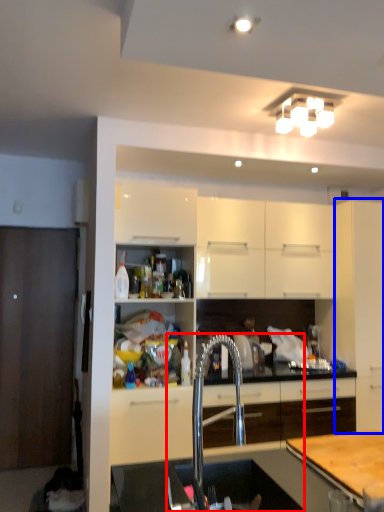
Question: Which object is closer to the camera taking this photo, sink (highlighted by a red box) or cabinetry (highlighted by a blue box)?

Choices:
 (A) sink
 (B) cabinetry

Answer: (A)